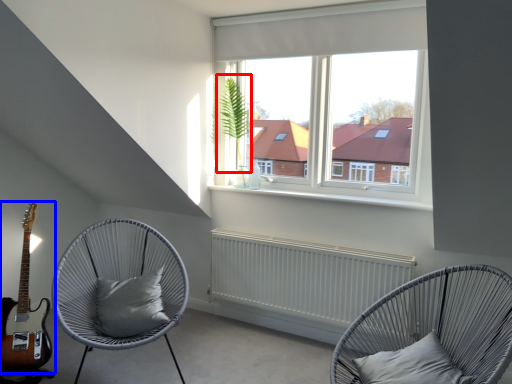
Question: Which object appears closest to the camera in this image, plant (highlighted by a red box) or guitar (highlighted by a blue box)?

Choices:
 (A) plant
 (B) guitar

Answer: (B)